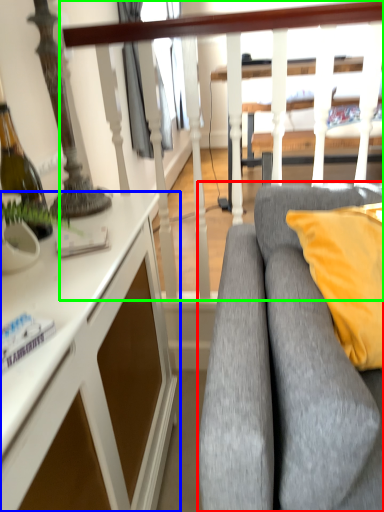
Question: Considering the real-world distances, which object is closest to studio couch (highlighted by a red box)? desk (highlighted by a blue box) or rail (highlighted by a green box).

Choices:
 (A) desk
 (B) rail

Answer: (A)